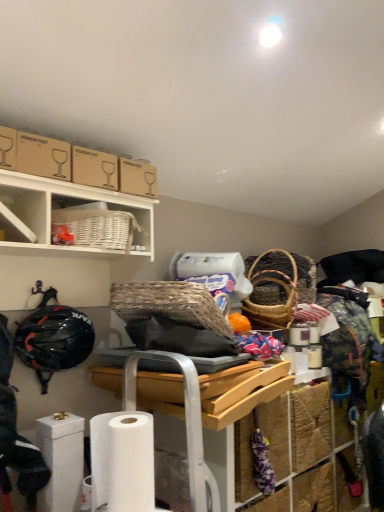
Question: Is matte cardboard box at upper left shorter than white matte toilet paper at lower left, the second toilet paper positioned from the back?

Choices:
 (A) no
 (B) yes

Answer: (B)

Question: Can you confirm if matte cardboard box at upper left is taller than white matte toilet paper at lower left, the 1th toilet paper positioned from the front?

Choices:
 (A) yes
 (B) no

Answer: (B)

Question: Does matte cardboard box at upper left have a greater width compared to white matte toilet paper at lower left, the 1th toilet paper positioned from the front?

Choices:
 (A) no
 (B) yes

Answer: (B)

Question: From a real-world perspective, is matte cardboard box at upper left over white matte toilet paper at lower left, which is the first toilet paper in right-to-left order?

Choices:
 (A) yes
 (B) no

Answer: (A)

Question: From the image's perspective, is matte cardboard box at upper left under white matte toilet paper at lower left, the second toilet paper positioned from the back?

Choices:
 (A) yes
 (B) no

Answer: (B)

Question: Would you consider matte cardboard box at upper left to be distant from white matte toilet paper at lower left, the second toilet paper positioned from the back?

Choices:
 (A) yes
 (B) no

Answer: (B)

Question: Is white matte cabinet at upper left looking in the opposite direction of white matte toilet paper at lower left, placed as the 2th toilet paper when sorted from front to back?

Choices:
 (A) no
 (B) yes

Answer: (A)

Question: Can you confirm if white matte cabinet at upper left is positioned to the right of white matte toilet paper at lower left, marked as the first toilet paper in a left-to-right arrangement?

Choices:
 (A) no
 (B) yes

Answer: (A)

Question: Does white matte cabinet at upper left appear on the left side of white matte toilet paper at lower left, placed as the 2th toilet paper when sorted from front to back?

Choices:
 (A) yes
 (B) no

Answer: (A)

Question: Is white matte cabinet at upper left smaller than white matte toilet paper at lower left, the first toilet paper in the back-to-front sequence?

Choices:
 (A) yes
 (B) no

Answer: (B)

Question: Is white matte cabinet at upper left far from white matte toilet paper at lower left, placed as the second toilet paper when sorted from right to left?

Choices:
 (A) no
 (B) yes

Answer: (A)

Question: From a real-world perspective, is white matte cabinet at upper left on top of white matte toilet paper at lower left, the first toilet paper in the back-to-front sequence?

Choices:
 (A) no
 (B) yes

Answer: (B)

Question: Considering the relative sizes of matte cardboard box at upper left and white wicker basket at upper left, which ranks as the 1th shelf in left-to-right order, in the image provided, is matte cardboard box at upper left smaller than white wicker basket at upper left, which ranks as the 1th shelf in left-to-right order,?

Choices:
 (A) no
 (B) yes

Answer: (B)